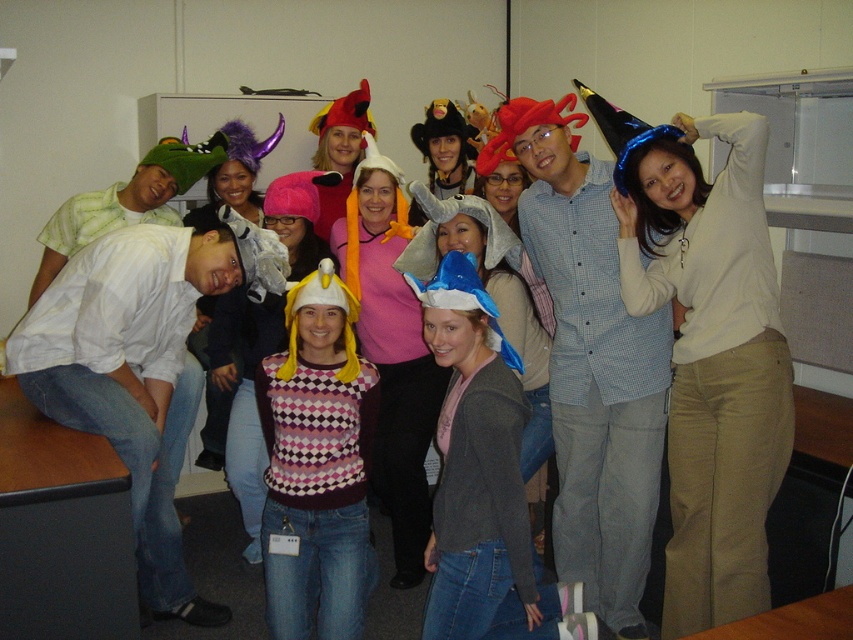
Consider the image. Measure the distance between checkered fabric shirt at center and camera.

They are 7.92 feet apart.

Consider the image. Who is positioned more to the right, checkered fabric shirt at center or plaid sweater at center?

From the viewer's perspective, checkered fabric shirt at center appears more on the right side.

The height and width of the screenshot is (640, 853). Find the location of `checkered fabric shirt at center`. checkered fabric shirt at center is located at coordinates (592, 368).

Does checkered sweater at center lie behind green fabric hat at left?

No, it is in front of green fabric hat at left.

Where is `checkered sweater at center`? checkered sweater at center is located at coordinates (x=392, y=353).

Between point (367, 276) and point (64, 252), which one is positioned in front?

Point (367, 276)

Identify the location of checkered sweater at center. The height and width of the screenshot is (640, 853). (392, 353).

Who is taller, blue glitter party hat at upper right or checkered fabric shirt at center?

checkered fabric shirt at center

Between blue glitter party hat at upper right and checkered fabric shirt at center, which one appears on the right side from the viewer's perspective?

blue glitter party hat at upper right

Describe the element at coordinates (712, 364) in the screenshot. I see `blue glitter party hat at upper right` at that location.

Where is `blue glitter party hat at upper right`? This screenshot has height=640, width=853. blue glitter party hat at upper right is located at coordinates (712, 364).